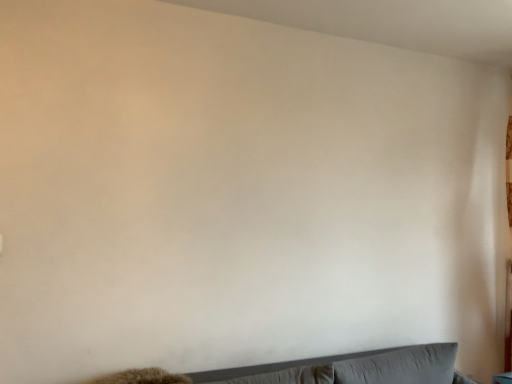
Where is `gray fabric couch at lower center`? This screenshot has height=384, width=512. gray fabric couch at lower center is located at coordinates (278, 365).

From the picture: Measure the distance between gray fabric pillow at lower right, arranged as the first pillow when viewed from the right, and camera.

gray fabric pillow at lower right, arranged as the first pillow when viewed from the right, is 1.95 meters away from camera.

The width and height of the screenshot is (512, 384). I want to click on gray fabric couch at lower center, so click(278, 365).

From a real-world perspective, is gray fabric pillow at lower right, arranged as the first pillow when viewed from the right, below gray fabric pillow at lower center, the 1th pillow viewed from the left?

Yes.

Between gray fabric pillow at lower right, arranged as the first pillow when viewed from the right, and gray fabric pillow at lower center, the 1th pillow viewed from the left, which one has larger width?

gray fabric pillow at lower center, the 1th pillow viewed from the left.

Is gray fabric pillow at lower center, the 1th pillow viewed from the left, surrounded by gray fabric pillow at lower right, which appears as the second pillow when viewed from the left?

That's incorrect, gray fabric pillow at lower center, the 1th pillow viewed from the left, is not inside gray fabric pillow at lower right, which appears as the second pillow when viewed from the left.

Is point (286, 365) positioned before point (361, 382)?

No, it is behind (361, 382).

Can you confirm if gray fabric couch at lower center is bigger than gray fabric pillow at lower right, which appears as the second pillow when viewed from the left?

Yes, gray fabric couch at lower center is bigger than gray fabric pillow at lower right, which appears as the second pillow when viewed from the left.

Considering the relative sizes of gray fabric couch at lower center and gray fabric pillow at lower right, arranged as the first pillow when viewed from the right, in the image provided, is gray fabric couch at lower center taller than gray fabric pillow at lower right, arranged as the first pillow when viewed from the right,?

Yes, gray fabric couch at lower center is taller than gray fabric pillow at lower right, arranged as the first pillow when viewed from the right.

Is the surface of gray fabric couch at lower center in direct contact with gray fabric pillow at lower right, arranged as the first pillow when viewed from the right?

No, gray fabric couch at lower center is not next to gray fabric pillow at lower right, arranged as the first pillow when viewed from the right.

How many degrees apart are the facing directions of gray fabric pillow at lower center, the 1th pillow viewed from the left, and gray fabric couch at lower center?

gray fabric pillow at lower center, the 1th pillow viewed from the left, and gray fabric couch at lower center are facing 3.16 degrees away from each other.

Is gray fabric pillow at lower center, the 1th pillow viewed from the left, taller than gray fabric couch at lower center?

No, gray fabric pillow at lower center, the 1th pillow viewed from the left, is not taller than gray fabric couch at lower center.

From a real-world perspective, which object rests below the other?

gray fabric couch at lower center, from a real-world perspective.

Can you confirm if gray fabric pillow at lower center, acting as the 2th pillow starting from the right, is wider than gray fabric couch at lower center?

No.

Based on the photo, choose the correct answer: Is gray fabric pillow at lower right, which appears as the second pillow when viewed from the left, inside gray fabric couch at lower center or outside it?

gray fabric pillow at lower right, which appears as the second pillow when viewed from the left, exists entirely within gray fabric couch at lower center.

Is there a large distance between gray fabric pillow at lower right, arranged as the first pillow when viewed from the right, and gray fabric couch at lower center?

No, gray fabric pillow at lower right, arranged as the first pillow when viewed from the right, is not far away from gray fabric couch at lower center.

Considering the positions of objects gray fabric pillow at lower right, arranged as the first pillow when viewed from the right, and gray fabric couch at lower center in the image provided, who is behind, gray fabric pillow at lower right, arranged as the first pillow when viewed from the right, or gray fabric couch at lower center?

Positioned behind is gray fabric pillow at lower right, arranged as the first pillow when viewed from the right.

Is gray fabric couch at lower center looking in the opposite direction of gray fabric pillow at lower center, acting as the 2th pillow starting from the right?

Absolutely, gray fabric couch at lower center is directed away from gray fabric pillow at lower center, acting as the 2th pillow starting from the right.

Considering the relative sizes of gray fabric couch at lower center and gray fabric pillow at lower center, the 1th pillow viewed from the left, in the image provided, is gray fabric couch at lower center smaller than gray fabric pillow at lower center, the 1th pillow viewed from the left,?

No.

Do you think gray fabric couch at lower center is within gray fabric pillow at lower center, acting as the 2th pillow starting from the right, or outside of it?

gray fabric couch at lower center lies outside gray fabric pillow at lower center, acting as the 2th pillow starting from the right.

From a real-world perspective, is gray fabric pillow at lower center, the 1th pillow viewed from the left, physically located above or below gray fabric pillow at lower right, arranged as the first pillow when viewed from the right?

Clearly, from a real-world perspective, gray fabric pillow at lower center, the 1th pillow viewed from the left, is above gray fabric pillow at lower right, arranged as the first pillow when viewed from the right.

Does gray fabric pillow at lower center, acting as the 2th pillow starting from the right, touch gray fabric pillow at lower right, which appears as the second pillow when viewed from the left?

There is a gap between gray fabric pillow at lower center, acting as the 2th pillow starting from the right, and gray fabric pillow at lower right, which appears as the second pillow when viewed from the left.

Who is bigger, gray fabric pillow at lower center, acting as the 2th pillow starting from the right, or gray fabric pillow at lower right, which appears as the second pillow when viewed from the left?

gray fabric pillow at lower right, which appears as the second pillow when viewed from the left.

Is gray fabric pillow at lower center, acting as the 2th pillow starting from the right, situated inside gray fabric pillow at lower right, which appears as the second pillow when viewed from the left, or outside?

The correct answer is: outside.

There is a gray fabric pillow at lower right, which appears as the second pillow when viewed from the left. At what (x,y) coordinates should I click in order to perform the action: click on pillow above it (from a real-world perspective). Please return your answer as a coordinate pair (x, y). Looking at the image, I should click on (287, 376).

Identify the location of couch located on the left of gray fabric pillow at lower right, arranged as the first pillow when viewed from the right. (278, 365).

In the scene shown: From the image, which object appears to be farther from gray fabric pillow at lower right, which appears as the second pillow when viewed from the left, gray fabric pillow at lower center, acting as the 2th pillow starting from the right, or gray fabric couch at lower center?

gray fabric pillow at lower center, acting as the 2th pillow starting from the right, is further to gray fabric pillow at lower right, which appears as the second pillow when viewed from the left.

From the picture: Looking at the image, which one is located further to gray fabric pillow at lower center, the 1th pillow viewed from the left, gray fabric pillow at lower right, arranged as the first pillow when viewed from the right, or gray fabric couch at lower center?

gray fabric pillow at lower right, arranged as the first pillow when viewed from the right.

Looking at the image, which one is located closer to gray fabric pillow at lower right, arranged as the first pillow when viewed from the right, gray fabric couch at lower center or gray fabric pillow at lower center, the 1th pillow viewed from the left?

gray fabric couch at lower center is positioned closer to the anchor gray fabric pillow at lower right, arranged as the first pillow when viewed from the right.

Which object lies further to the anchor point gray fabric couch at lower center, gray fabric pillow at lower right, which appears as the second pillow when viewed from the left, or gray fabric pillow at lower center, acting as the 2th pillow starting from the right?

gray fabric pillow at lower right, which appears as the second pillow when viewed from the left, lies further to gray fabric couch at lower center than the other object.

Based on their spatial positions, is gray fabric couch at lower center or gray fabric pillow at lower right, which appears as the second pillow when viewed from the left, closer to gray fabric pillow at lower center, the 1th pillow viewed from the left?

Based on the image, gray fabric couch at lower center appears to be nearer to gray fabric pillow at lower center, the 1th pillow viewed from the left.

Based on their spatial positions, is gray fabric pillow at lower center, acting as the 2th pillow starting from the right, or gray fabric pillow at lower right, which appears as the second pillow when viewed from the left, closer to gray fabric couch at lower center?

Based on the image, gray fabric pillow at lower center, acting as the 2th pillow starting from the right, appears to be nearer to gray fabric couch at lower center.

At what (x,y) coordinates should I click in order to perform the action: click on pillow located between gray fabric couch at lower center and gray fabric pillow at lower right, which appears as the second pillow when viewed from the left, in the depth direction. Please return your answer as a coordinate pair (x, y). This screenshot has height=384, width=512. Looking at the image, I should click on (287, 376).